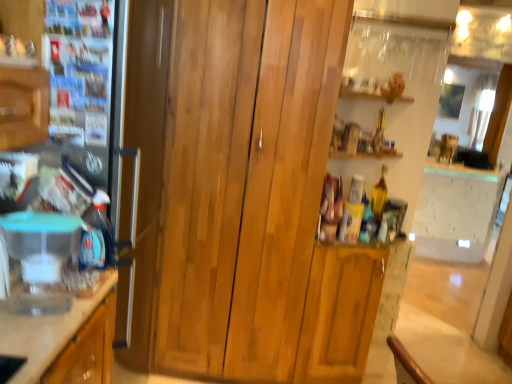
In order to click on free space in front of transparent plastic container at left in this screenshot , I will do `click(29, 337)`.